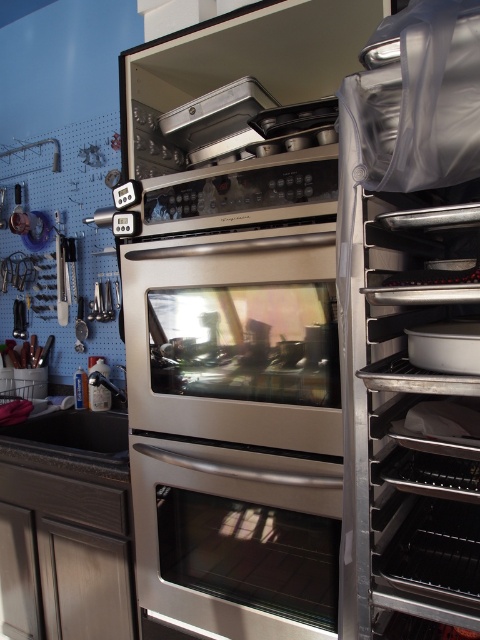
How much distance is there between silver metallic baking tray at right and black matte sink at lower left?

silver metallic baking tray at right is 1.01 meters from black matte sink at lower left.

Does silver metallic baking tray at right have a lesser width compared to black matte sink at lower left?

Yes.

Where is `silver metallic baking tray at right`? silver metallic baking tray at right is located at coordinates pos(409,324).

Can you confirm if silver metallic baking tray at right is positioned below satin stainless steel oven at center?

Incorrect, silver metallic baking tray at right is not positioned below satin stainless steel oven at center.

From the picture: Does silver metallic baking tray at right have a lesser height compared to satin stainless steel oven at center?

Incorrect, silver metallic baking tray at right's height does not fall short of satin stainless steel oven at center's.

Does point (432, 600) come closer to viewer compared to point (330, 516)?

Yes, it is.

I want to click on silver metallic baking tray at right, so click(409, 324).

Consider the image. Is silver metallic baking tray at right above metallic silver exhaust hood at upper center?

No.

Is point (423, 480) farther from viewer compared to point (165, 131)?

No, (423, 480) is closer to viewer.

Find the location of `silver metallic baking tray at right`. silver metallic baking tray at right is located at coordinates pyautogui.click(x=409, y=324).